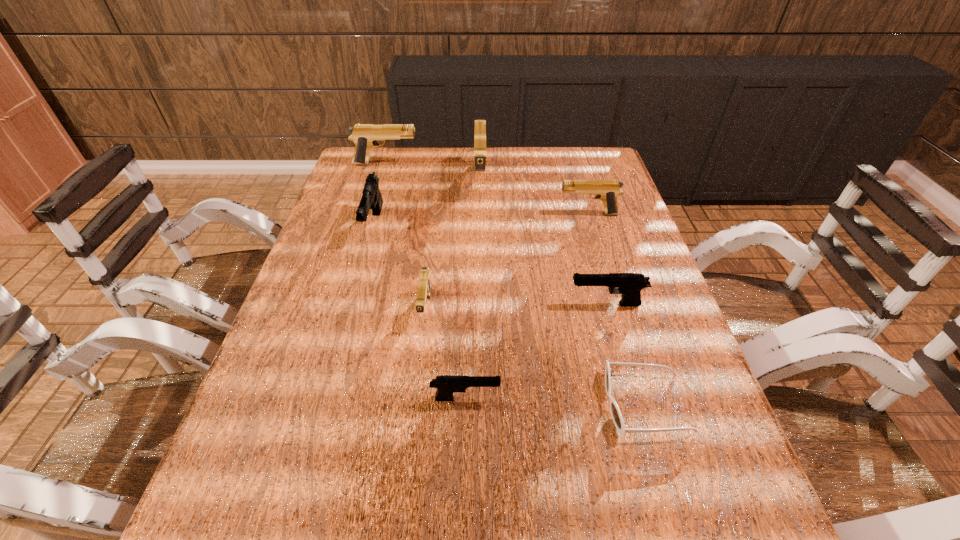
Where is `vacant area that lies between the smallest tan pistol and the biggest tan pistol`? vacant area that lies between the smallest tan pistol and the biggest tan pistol is located at coordinates (453, 246).

Locate an element on the screen. The image size is (960, 540). blank region between the sixth object from right to left and the rightmost black pistol is located at coordinates (516, 307).

This screenshot has width=960, height=540. Find the location of `free space between the second smallest tan pistol and the smallest tan pistol`. free space between the second smallest tan pistol and the smallest tan pistol is located at coordinates (507, 262).

This screenshot has height=540, width=960. Identify the location of free space between the second nearest black pistol and the nearest tan pistol. (516, 307).

Point out which object is positioned as the second nearest to the biggest tan pistol. Please provide its 2D coordinates. Your answer should be formatted as a tuple, i.e. [(x, y)], where the tuple contains the x and y coordinates of a point satisfying the conditions above.

[(607, 191)]

This screenshot has height=540, width=960. Find the location of `object that is the second closest to the second smallest tan pistol`. object that is the second closest to the second smallest tan pistol is located at coordinates (630, 285).

You are a GUI agent. You are given a task and a screenshot of the screen. Output one action in this format:
    pyautogui.click(x=<x>, y=<y>)
    Task: Click on the third closest pistol to the second farthest black pistol
    
    Given the screenshot: What is the action you would take?
    pyautogui.click(x=607, y=191)

Identify the location of the third closest pistol to the second biggest black pistol. The height and width of the screenshot is (540, 960). (607, 191).

Point out which tan pistol is positioned as the nearest to the rightmost black pistol. Please provide its 2D coordinates. Your answer should be formatted as a tuple, i.e. [(x, y)], where the tuple contains the x and y coordinates of a point satisfying the conditions above.

[(424, 288)]

This screenshot has width=960, height=540. I want to click on tan pistol that is the third closest to the second tan pistol from right to left, so click(x=424, y=288).